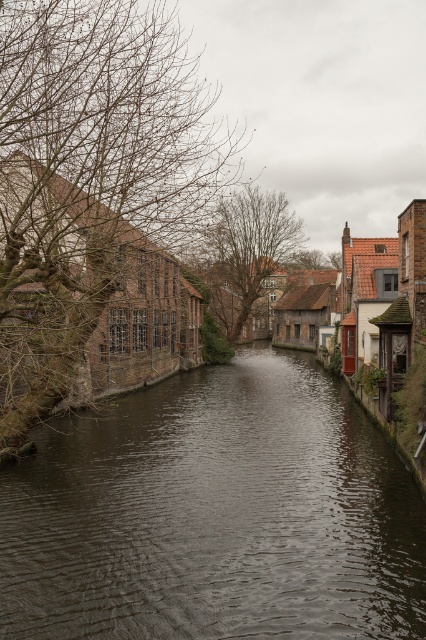
What do you see at coordinates (89, 177) in the screenshot? I see `bare branches at left` at bounding box center [89, 177].

Does bare branches at left lie in front of brown leafless tree at center?

That is True.

What do you see at coordinates (89, 177) in the screenshot? I see `bare branches at left` at bounding box center [89, 177].

Identify the location of bare branches at left. (89, 177).

Can you confirm if dark brown water at center is positioned to the right of bare branches at left?

Yes, dark brown water at center is to the right of bare branches at left.

Which is in front, point (109, 522) or point (14, 115)?

Point (14, 115)

Who is more distant from viewer, (x=203, y=483) or (x=14, y=356)?

The point (x=203, y=483) is behind.

You are a GUI agent. You are given a task and a screenshot of the screen. Output one action in this format:
    pyautogui.click(x=<x>, y=<y>)
    Task: Click on the dark brown water at center
    This screenshot has width=426, height=640.
    Given the screenshot: What is the action you would take?
    pyautogui.click(x=215, y=515)

Which of these two, dark brown water at center or brown leafless tree at center, stands shorter?

dark brown water at center is shorter.

Is point (164, 604) closer to camera compared to point (224, 214)?

Yes, point (164, 604) is closer to viewer.

You are a GUI agent. You are given a task and a screenshot of the screen. Output one action in this format:
    pyautogui.click(x=<x>, y=<y>)
    Task: Click on the dark brown water at center
    The image size is (426, 640).
    Given the screenshot: What is the action you would take?
    pyautogui.click(x=215, y=515)